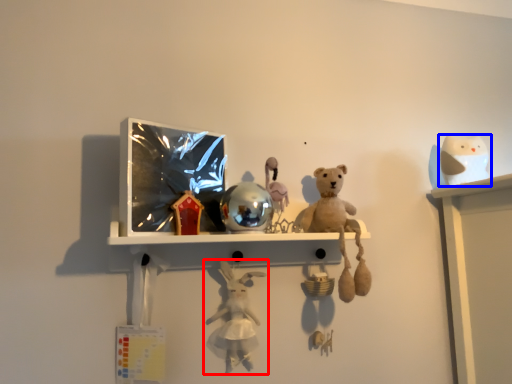
Question: Which object appears closest to the camera in this image, toy (highlighted by a red box) or toy (highlighted by a blue box)?

Choices:
 (A) toy
 (B) toy

Answer: (A)